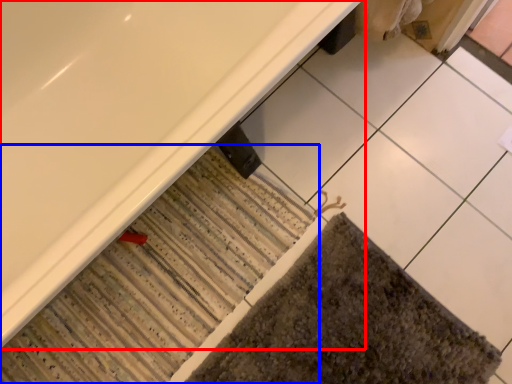
Question: Which object is closer to the camera taking this photo, bathtub (highlighted by a red box) or bath mat (highlighted by a blue box)?

Choices:
 (A) bathtub
 (B) bath mat

Answer: (A)